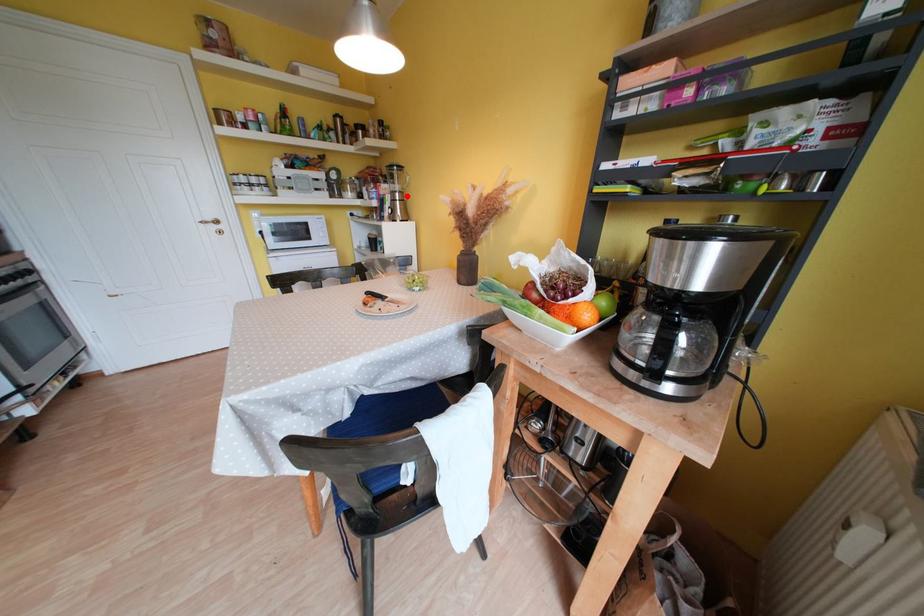
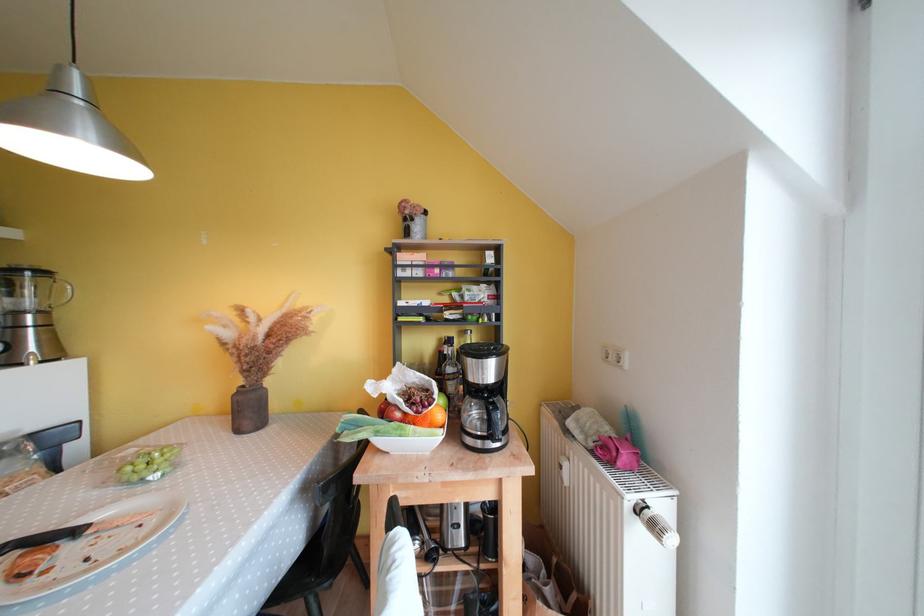
Find the pixel in the second image that matches the highlighted location in the first image.

(49, 315)